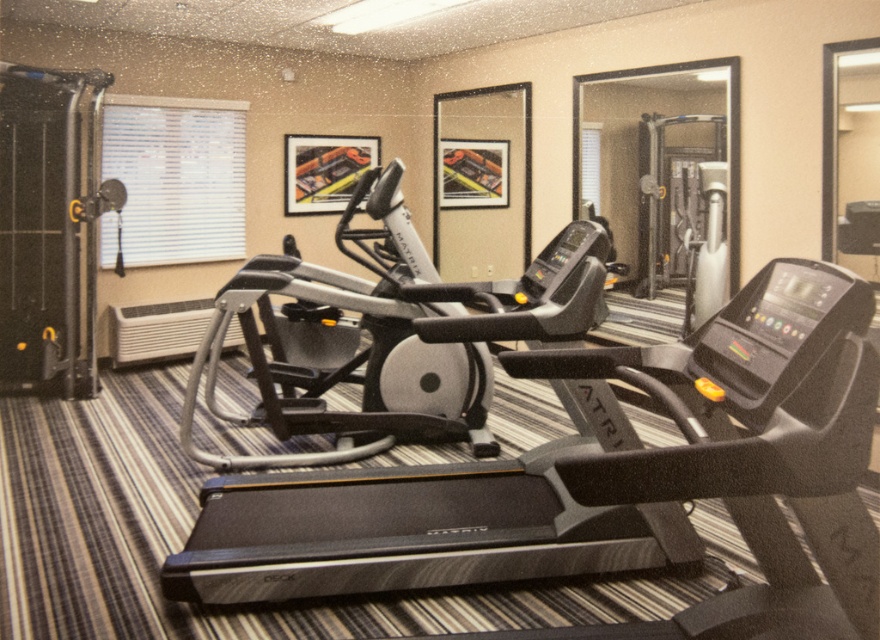
Question: Can you confirm if black plastic treadmill at center is positioned above silver metallic elliptical trainer at center?

Choices:
 (A) yes
 (B) no

Answer: (B)

Question: Which point is farther to the camera?

Choices:
 (A) black plastic treadmill at center
 (B) silver metallic elliptical trainer at center

Answer: (B)

Question: Can you confirm if black plastic treadmill at center is positioned below silver metallic elliptical trainer at center?

Choices:
 (A) yes
 (B) no

Answer: (A)

Question: Which point is farther to the camera?

Choices:
 (A) (390, 186)
 (B) (501, 474)

Answer: (A)

Question: Which point is closer to the camera?

Choices:
 (A) (445, 508)
 (B) (189, 422)

Answer: (A)

Question: Is black plastic treadmill at center to the left of silver metallic elliptical trainer at center from the viewer's perspective?

Choices:
 (A) no
 (B) yes

Answer: (A)